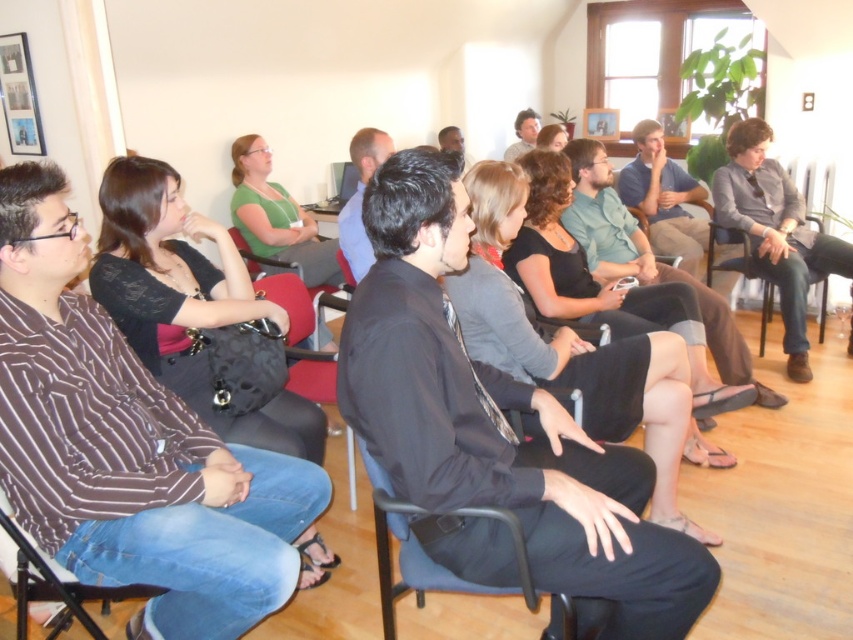
You are sitting in the striped fabric chair at lower left and want to see the person wearing the gray cotton shirt at right. Can you see them without moving your head?

The striped fabric chair at lower left is behind the gray cotton shirt at right, so you cannot see them without moving your head.

You are organizing a small workshop and need to seat two attendees. You have a black fabric chair at center and a striped fabric chair at lower left. Which chair provides more seating space for a larger attendee?

The black fabric chair at center provides more seating space because its width is larger than the striped fabric chair at lower left.

You are organizing a photo shoot and need to ensure that all items in the frame are appropriately sized. Given the gray cotton shirt at right and the striped fabric chair at lower left, which item would require more space in the background to avoid overcrowding?

The gray cotton shirt at right requires more space in the background because it is bigger than the striped fabric chair at lower left.